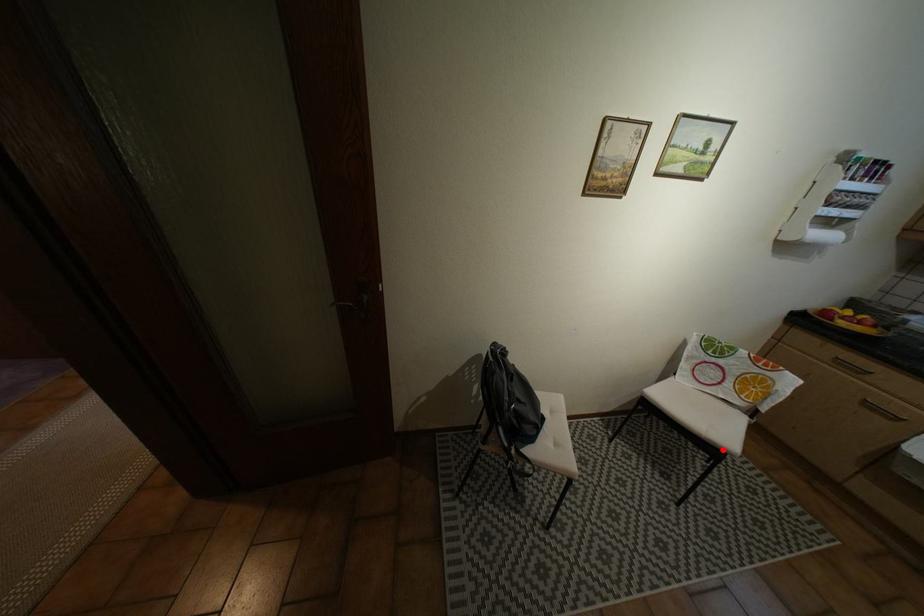
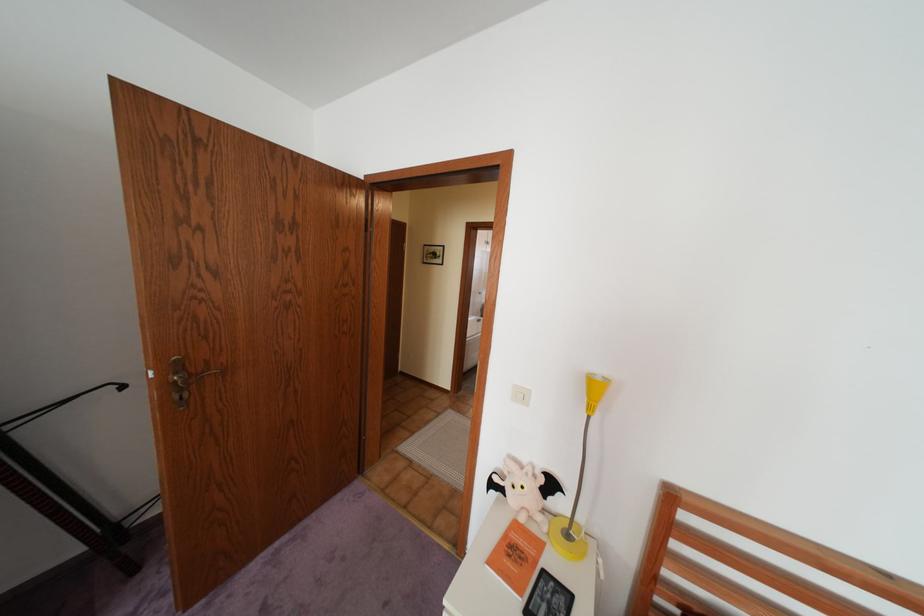
Question: I am providing you with two images of the same scene from different viewpoints. A red point is marked on the first image. Can you still see the location of the red point in image 2?

Choices:
 (A) Yes
 (B) No

Answer: (B)